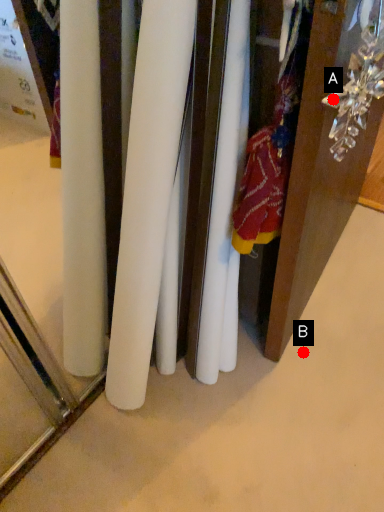
Question: Two points are circled on the image, labeled by A and B beside each circle. Among these points, which one is farthest from the camera?

Choices:
 (A) A is further
 (B) B is further

Answer: (B)